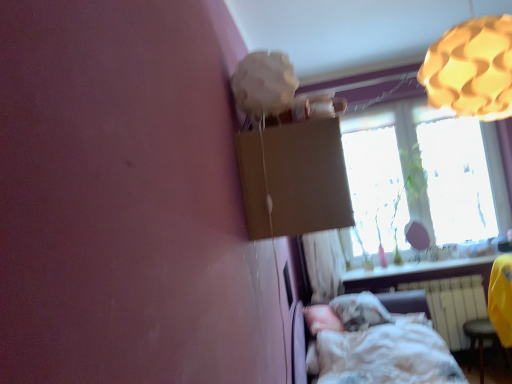
Locate an element on the screen. This screenshot has width=512, height=384. vacant area on top of white matte radiator at lower right (from a real-world perspective) is located at coordinates (433, 273).